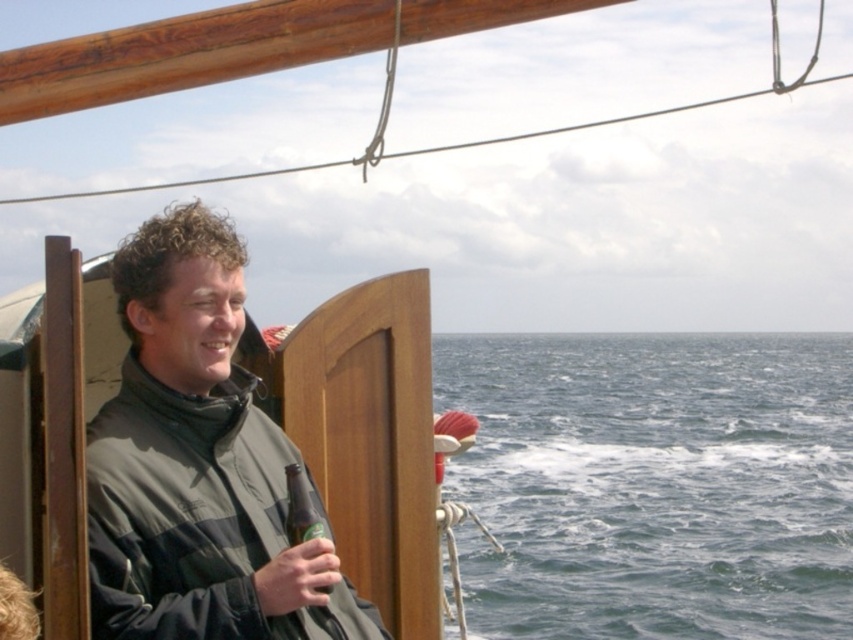
Question: Is blue water at lower right thinner than dark green matte jacket at left?

Choices:
 (A) yes
 (B) no

Answer: (B)

Question: Estimate the real-world distances between objects in this image. Which object is farther from the blue water at lower right?

Choices:
 (A) dark green matte jacket at left
 (B) green glass bottle at center

Answer: (B)

Question: Is dark green matte jacket at left further to the viewer compared to green glass bottle at center?

Choices:
 (A) yes
 (B) no

Answer: (B)

Question: Is blue water at lower right above dark green matte jacket at left?

Choices:
 (A) yes
 (B) no

Answer: (B)

Question: Among these objects, which one is farthest from the camera?

Choices:
 (A) blue water at lower right
 (B) dark green matte jacket at left
 (C) green glass bottle at center

Answer: (A)

Question: Which object appears farthest from the camera in this image?

Choices:
 (A) dark green matte jacket at left
 (B) green glass bottle at center
 (C) blue water at lower right

Answer: (C)